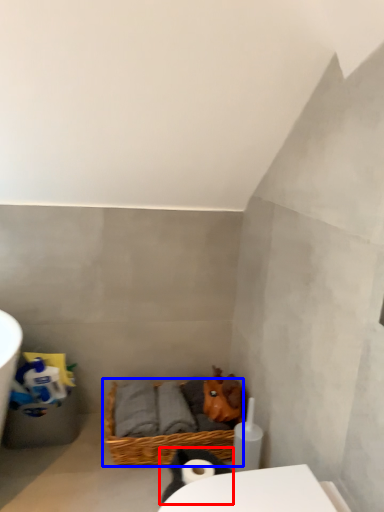
Question: Which of the following is the farthest to the observer, animal (highlighted by a red box) or basket (highlighted by a blue box)?

Choices:
 (A) animal
 (B) basket

Answer: (B)